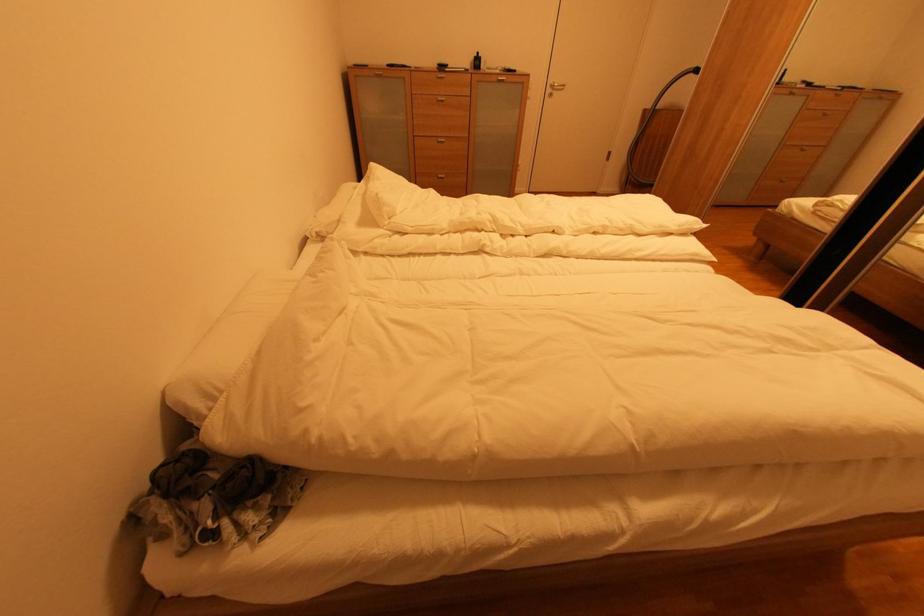
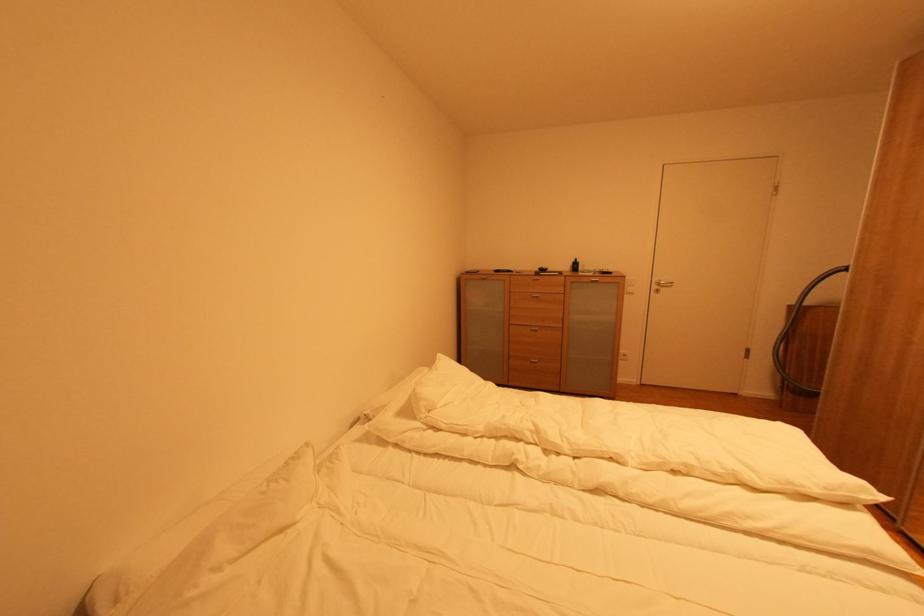
Find the pixel in the second image that matches point (448, 102) in the first image.

(542, 298)